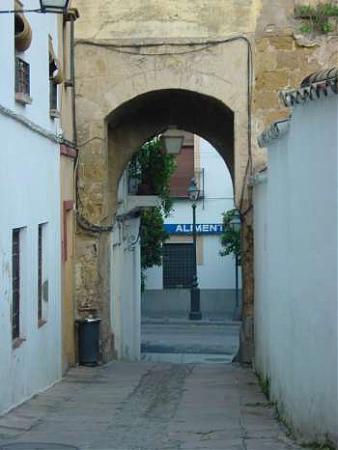
The image size is (338, 450). I want to click on window, so click(22, 315).